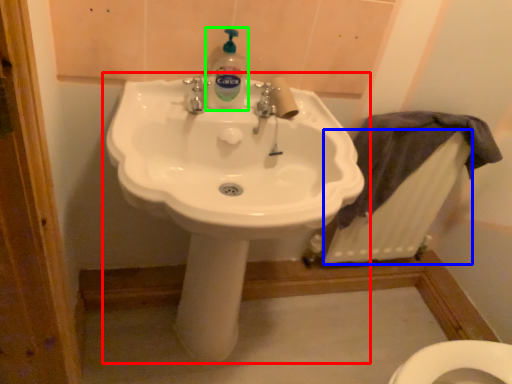
Question: Based on their relative distances, which object is nearer to sink (highlighted by a red box)? Choose from radiator (highlighted by a blue box) and cleaning product (highlighted by a green box).

Choices:
 (A) radiator
 (B) cleaning product

Answer: (B)